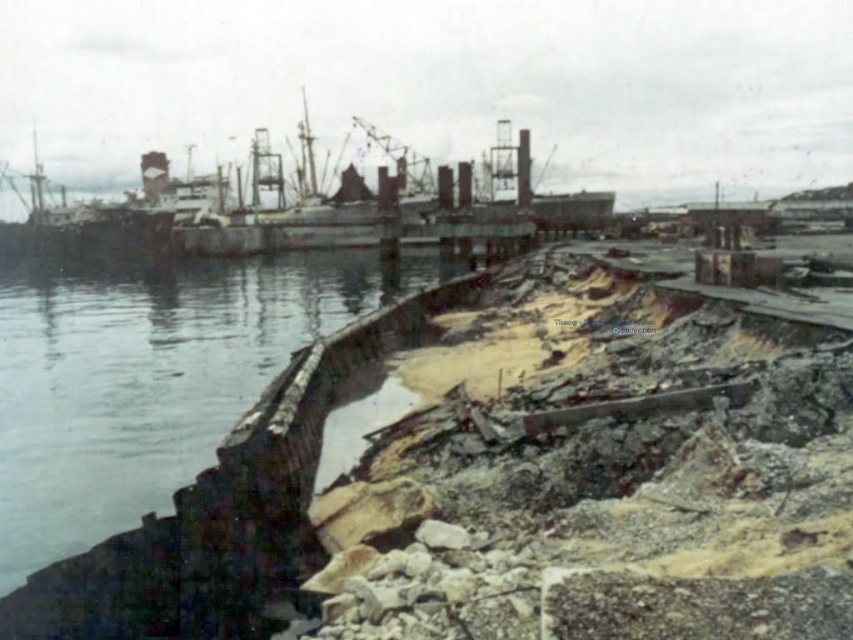
Question: Which point is closer to the camera?

Choices:
 (A) rusty metal ship at center
 (B) rusty metallic water at lower left

Answer: (B)

Question: Which point is farther to the camera?

Choices:
 (A) (233, 248)
 (B) (363, 264)

Answer: (A)

Question: Is rusty metallic water at lower left wider than rusty metal ship at center?

Choices:
 (A) no
 (B) yes

Answer: (A)

Question: Does rusty metallic water at lower left have a greater width compared to rusty metal ship at center?

Choices:
 (A) no
 (B) yes

Answer: (A)

Question: Is rusty metallic water at lower left smaller than rusty metal ship at center?

Choices:
 (A) no
 (B) yes

Answer: (B)

Question: Which of the following is the farthest from the observer?

Choices:
 (A) rusty metallic water at lower left
 (B) rusty metal ship at center

Answer: (B)